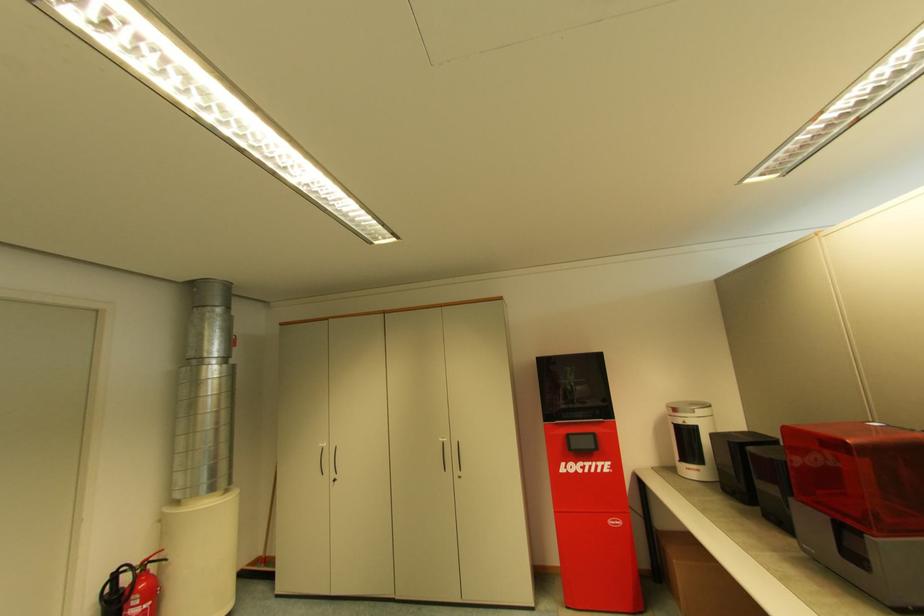
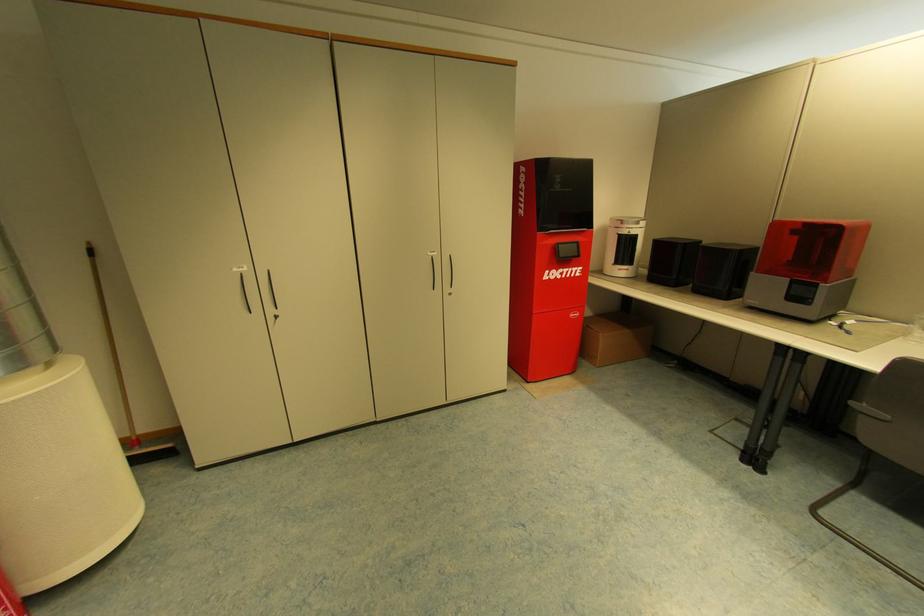
The point at (832,517) is marked in the first image. Where is the corresponding point in the second image?

(793, 280)